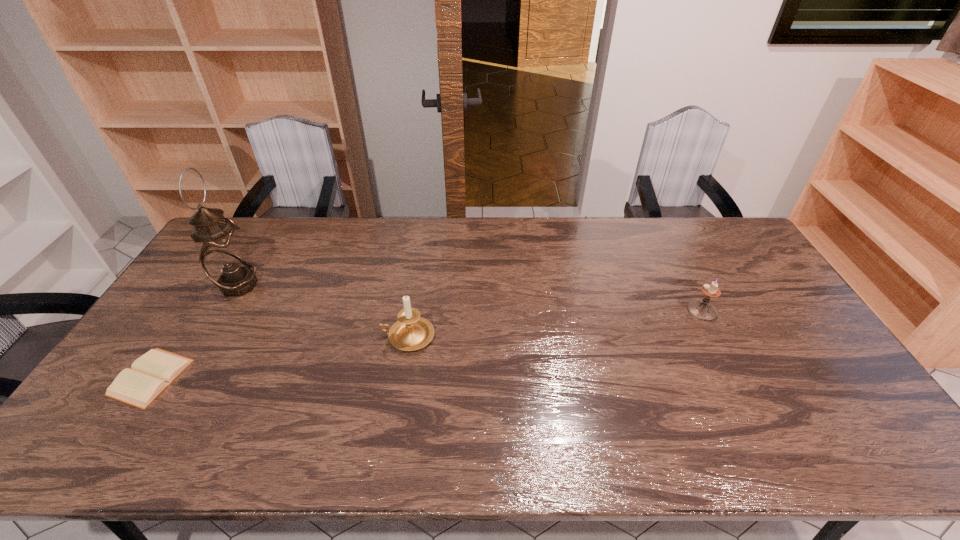
I want to click on oil lamp, so click(224, 258).

Where is `the second object from right to left`? Image resolution: width=960 pixels, height=540 pixels. the second object from right to left is located at coordinates (411, 332).

Image resolution: width=960 pixels, height=540 pixels. I want to click on the left candle holder, so click(411, 332).

Where is `the shorter candle holder`? The width and height of the screenshot is (960, 540). the shorter candle holder is located at coordinates (702, 309).

This screenshot has height=540, width=960. I want to click on the right candle holder, so point(702,309).

You are a GUI agent. You are given a task and a screenshot of the screen. Output one action in this format:
    pyautogui.click(x=<x>, y=<y>)
    Task: Click on the shortest object
    
    Given the screenshot: What is the action you would take?
    pyautogui.click(x=150, y=374)

Identify the location of blank area located on the front of the tallest object. (192, 364).

Image resolution: width=960 pixels, height=540 pixels. I want to click on blank space located with a handle on the side of the taller candle holder, so click(242, 336).

Locate an element on the screen. free point located with a handle on the side of the taller candle holder is located at coordinates (319, 336).

At what (x,y) coordinates should I click in order to perform the action: click on vacant area located with a handle on the side of the taller candle holder. Please return your answer as a coordinate pair (x, y). Looking at the image, I should click on (304, 336).